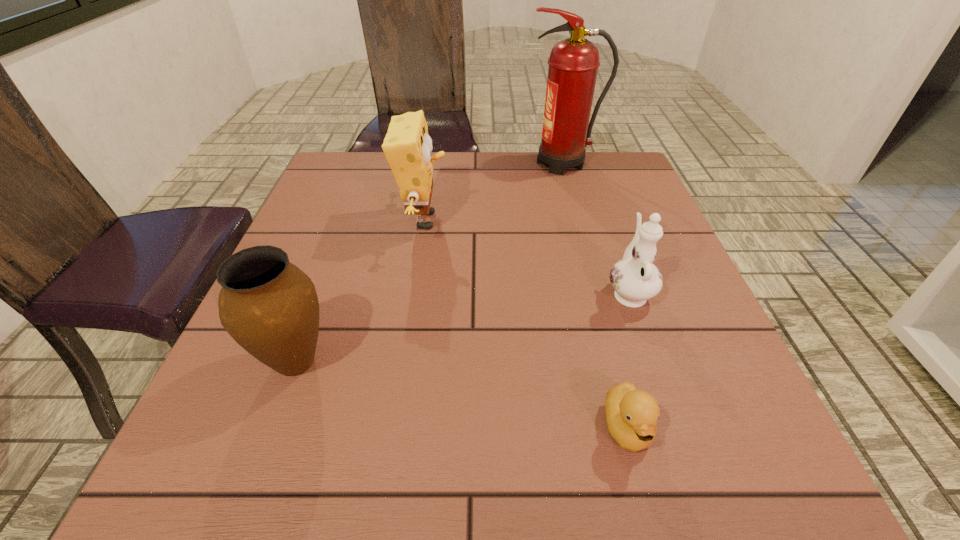
This screenshot has width=960, height=540. Identify the location of free space located 0.250m on the front-facing side of the fire extinguisher. (438, 164).

This screenshot has width=960, height=540. Identify the location of vacant space situated on the front-facing side of the fire extinguisher. (490, 164).

This screenshot has width=960, height=540. Identify the location of free space located on the face of the sponge. (557, 220).

This screenshot has height=540, width=960. I want to click on vacant area situated on the right of the second nearest object, so click(371, 361).

Identify the location of free point located at the spout of the chinaware. (616, 255).

You are a GUI agent. You are given a task and a screenshot of the screen. Output one action in this format:
    pyautogui.click(x=<x>, y=<y>)
    Task: Click on the free space located 0.310m at the spout of the chinaware
    The image size is (960, 540).
    Given the screenshot: What is the action you would take?
    pyautogui.click(x=594, y=192)

Find the location of `vacant space located at the spout of the chinaware`. vacant space located at the spout of the chinaware is located at coordinates click(x=597, y=202).

This screenshot has height=540, width=960. What are the coordinates of `fire extinguisher positioned at the far edge` in the screenshot? It's located at (573, 63).

The height and width of the screenshot is (540, 960). I want to click on sponge positioned at the far edge, so click(x=407, y=146).

You are a GUI agent. You are given a task and a screenshot of the screen. Output one action in this format:
    pyautogui.click(x=<x>, y=<y>)
    Task: Click on the object that is at the near edge
    Image resolution: width=960 pixels, height=540 pixels.
    Given the screenshot: What is the action you would take?
    pyautogui.click(x=632, y=414)